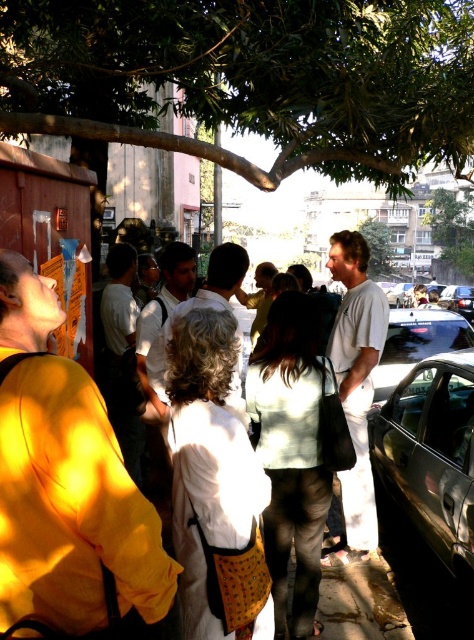
In the scene shown: You are a pedestrian walking along the sidewalk and see the green leafy tree at upper center and the shiny black car at right. Which object is located to the right of the other?

The green leafy tree at upper center is positioned on the right side of the shiny black car at right.

You are a pedestrian standing at the edge of the sidewalk and you see the shiny black car at right and the white cotton shirt at center. Which object is closer to the ground?

The shiny black car at right is closer to the ground because it is positioned below the white cotton shirt at center.

You are a delivery person needing to park your shiny black car at right near the sidewalk where the white cotton shirt at center is standing. Is there enough space to park without blocking the pedestrians?

The shiny black car at right is larger than the white cotton shirt at center, so there should be enough space to park the car without blocking the pedestrians, as the car can be positioned around the shirt wearer.